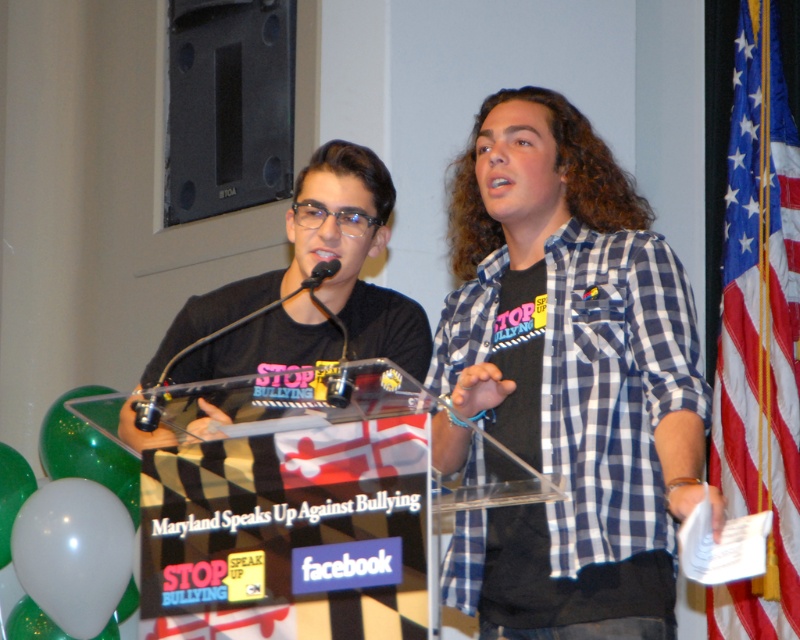
You are attending a public speaking event and notice a podium with a blue checkered shirt at center. Where is the blue checkered shirt located relative to the podium?

The blue checkered shirt at center is located at point (x=568, y=378) on the podium.

You are a photographer at the event and want to capture a closeup of both the blue checkered shirt at center and the black plastic microphone at center. Which object should you focus on first if you need to adjust your camera focus from near to far?

The blue checkered shirt at center is taller than the black plastic microphone at center, so you should focus on the blue checkered shirt at center first since it is farther away and requires adjusting focus from near to far.

From the picture: What are the coordinates of the blue checkered shirt at center?

The coordinates of the blue checkered shirt at center are at point (568, 378).